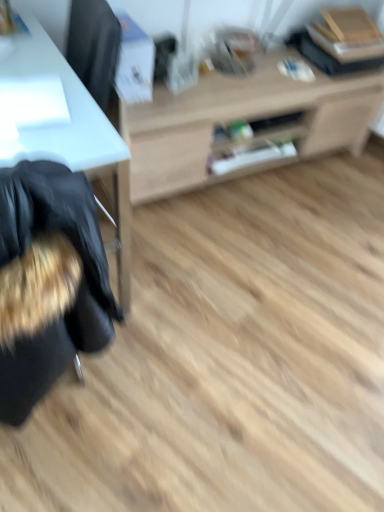
Question: Should I look upward or downward to see fuzzy black bean bag chair at left?

Choices:
 (A) up
 (B) down

Answer: (B)

Question: Considering the relative positions of white glossy desk at left and light wood cabinet at center in the image provided, is white glossy desk at left behind light wood cabinet at center?

Choices:
 (A) yes
 (B) no

Answer: (B)

Question: From the image's perspective, is white glossy desk at left on light wood cabinet at center?

Choices:
 (A) no
 (B) yes

Answer: (A)

Question: Is white glossy desk at left closer to camera compared to light wood cabinet at center?

Choices:
 (A) no
 (B) yes

Answer: (B)

Question: Does white glossy desk at left turn towards light wood cabinet at center?

Choices:
 (A) no
 (B) yes

Answer: (A)

Question: Considering the relative positions of white glossy desk at left and light wood cabinet at center in the image provided, is white glossy desk at left to the right of light wood cabinet at center from the viewer's perspective?

Choices:
 (A) yes
 (B) no

Answer: (B)

Question: Would you consider white glossy desk at left to be distant from light wood cabinet at center?

Choices:
 (A) no
 (B) yes

Answer: (A)

Question: Is light wood cabinet at center positioned in front of white glossy desk at left?

Choices:
 (A) no
 (B) yes

Answer: (A)

Question: Is light wood cabinet at center facing towards white glossy desk at left?

Choices:
 (A) yes
 (B) no

Answer: (B)

Question: Is light wood cabinet at center to the right of white glossy desk at left from the viewer's perspective?

Choices:
 (A) no
 (B) yes

Answer: (B)

Question: Considering the relative sizes of light wood cabinet at center and white glossy desk at left in the image provided, is light wood cabinet at center taller than white glossy desk at left?

Choices:
 (A) yes
 (B) no

Answer: (B)

Question: Is light wood cabinet at center to the left of white glossy desk at left from the viewer's perspective?

Choices:
 (A) yes
 (B) no

Answer: (B)

Question: Considering the relative sizes of light wood cabinet at center and white glossy desk at left in the image provided, is light wood cabinet at center shorter than white glossy desk at left?

Choices:
 (A) yes
 (B) no

Answer: (A)

Question: From a real-world perspective, is fuzzy black bean bag chair at left located beneath light wood cabinet at center?

Choices:
 (A) no
 (B) yes

Answer: (A)